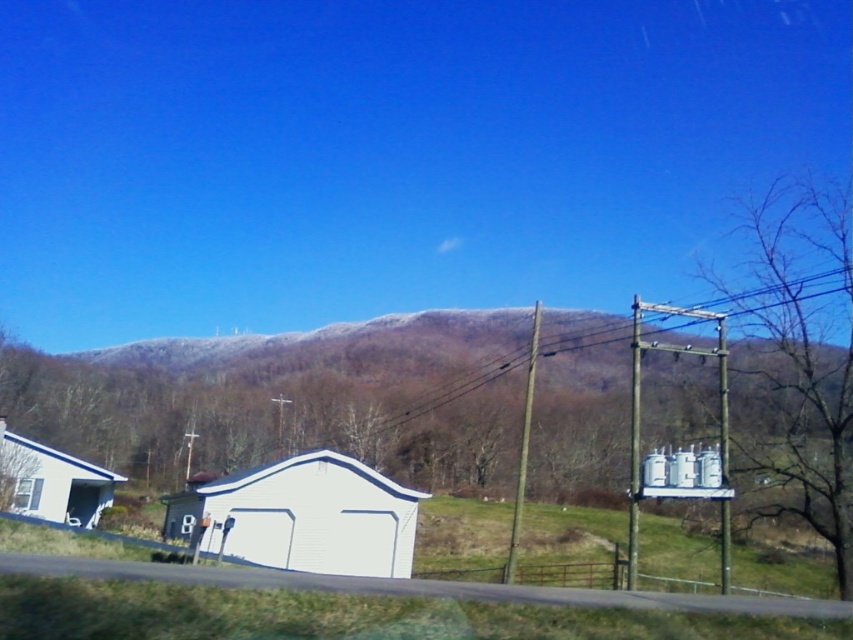
Question: Which is nearer to the white matte garage at lower left?

Choices:
 (A) white vinyl garage at center
 (B) transparent glass window at lower left
 (C) brown wooden power line at center

Answer: (B)

Question: Is white matte garage at lower left above transparent glass window at lower left?

Choices:
 (A) yes
 (B) no

Answer: (A)

Question: Which point is closer to the camera taking this photo?

Choices:
 (A) (291, 518)
 (B) (44, 492)

Answer: (A)

Question: Which of the following is the closest to the observer?

Choices:
 (A) white vinyl garage at center
 (B) transparent glass window at lower left
 (C) white matte garage at lower left

Answer: (A)

Question: Is white vinyl garage at center to the right of transparent glass window at lower left from the viewer's perspective?

Choices:
 (A) yes
 (B) no

Answer: (A)

Question: Does white vinyl garage at center have a larger size compared to transparent glass window at lower left?

Choices:
 (A) yes
 (B) no

Answer: (A)